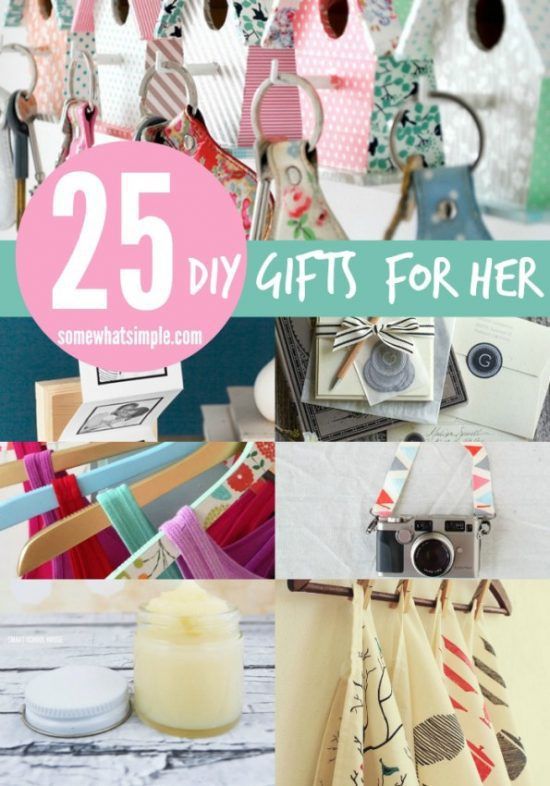
Identify the location of towel. The width and height of the screenshot is (550, 786). (392, 747), (424, 709), (454, 685), (483, 673).